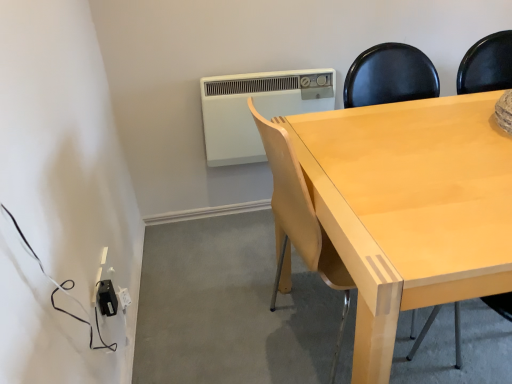
Image resolution: width=512 pixels, height=384 pixels. In order to click on free space to the left of light wood chair at center in this screenshot , I will do `click(221, 339)`.